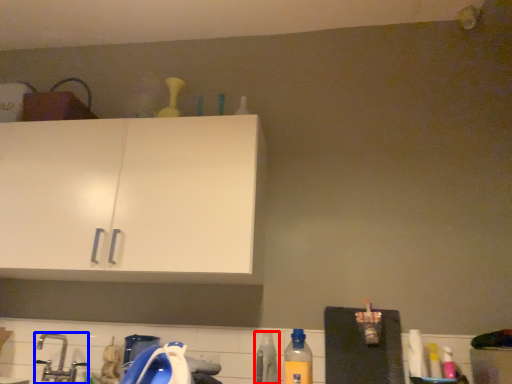
Question: Which object appears farthest to the camera in this image, bottle (highlighted by a red box) or faucet (highlighted by a blue box)?

Choices:
 (A) bottle
 (B) faucet

Answer: (B)